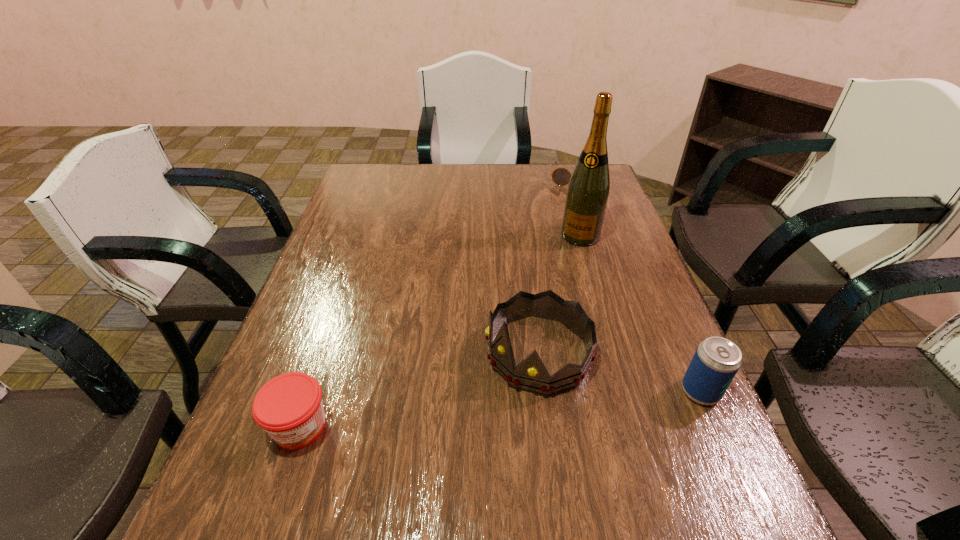
Find the location of a particular element. This screenshot has width=960, height=540. object at the left edge is located at coordinates (289, 407).

I want to click on beer can present at the right edge, so click(x=716, y=361).

This screenshot has height=540, width=960. Identify the location of wine bottle that is at the right edge. (587, 194).

Where is `sunglasses that is at the right edge`? This screenshot has width=960, height=540. sunglasses that is at the right edge is located at coordinates (561, 176).

The image size is (960, 540). Identify the location of object situated at the near left corner. click(289, 407).

This screenshot has width=960, height=540. Find the location of `object that is at the far right corner`. object that is at the far right corner is located at coordinates (561, 176).

This screenshot has width=960, height=540. Find the location of `free space at the far edge of the desktop`. free space at the far edge of the desktop is located at coordinates tap(444, 180).

Locate an element on the screen. Image resolution: width=960 pixels, height=540 pixels. vacant space at the near edge is located at coordinates (642, 477).

In the image, there is a desktop. Identify the location of free space at the left edge. The width and height of the screenshot is (960, 540). (277, 375).

In the image, there is a desktop. At what (x,y) coordinates should I click in order to perform the action: click on vacant space at the right edge. Please return your answer as a coordinate pair (x, y). Looking at the image, I should click on (699, 423).